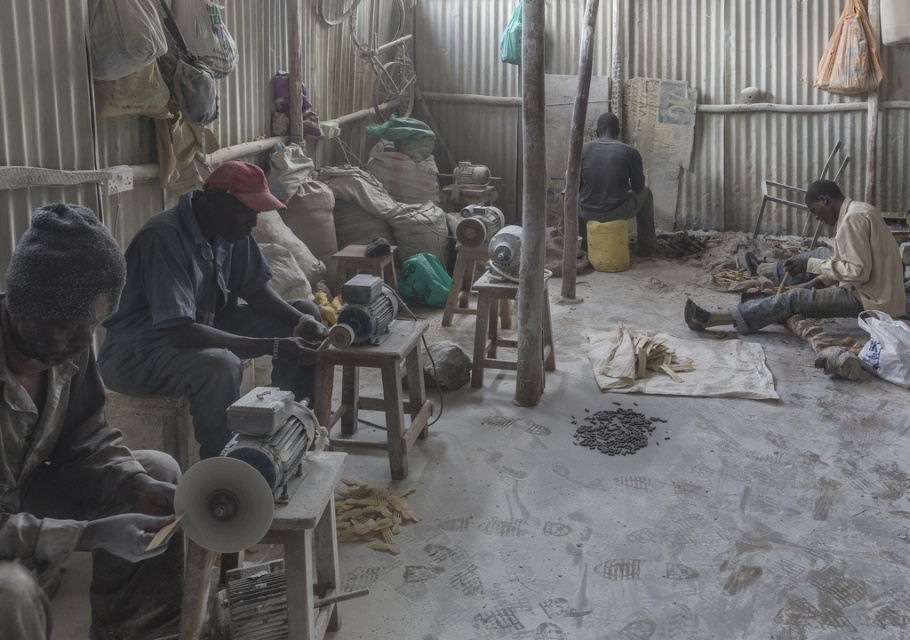
Which is in front, point (39, 392) or point (593, 154)?

Point (39, 392) is more forward.

Which is above, dark gray fabric at left or dark gray fabric at center?

dark gray fabric at center is above.

Which is in front, point (100, 627) or point (587, 214)?

Point (100, 627) is more forward.

Image resolution: width=910 pixels, height=640 pixels. Identify the location of dark gray fabric at left. (74, 444).

Which is above, dark gray fabric at left or blue denim shirt at center?

blue denim shirt at center is higher up.

At what (x,y) coordinates should I click in order to perform the action: click on dark gray fabric at left. Please return your answer as a coordinate pair (x, y). The image size is (910, 640). Looking at the image, I should click on (74, 444).

Which is in front, point (123, 532) or point (255, 188)?

Point (123, 532) is more forward.

Where is `dark gray fabric at left`? The width and height of the screenshot is (910, 640). dark gray fabric at left is located at coordinates (74, 444).

Measure the distance from blue denim shirt at center to wooden stool at center.

The distance of blue denim shirt at center from wooden stool at center is 41.24 centimeters.

Is blue denim shirt at center below wooden stool at center?

No.

Does point (261, 312) lie behind point (345, 417)?

No.

This screenshot has width=910, height=640. I want to click on blue denim shirt at center, so click(x=206, y=307).